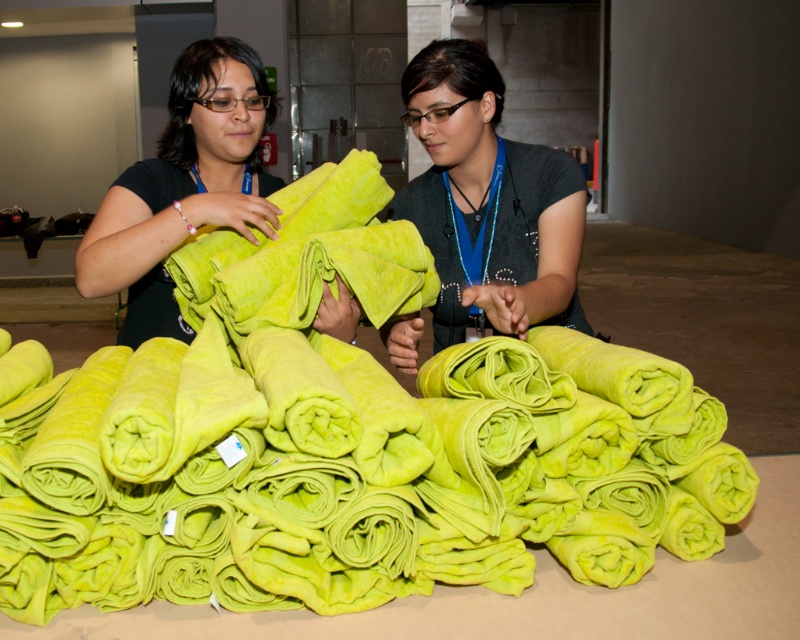
Question: Is lime green fleece blanket at center below matte green towel at center?

Choices:
 (A) no
 (B) yes

Answer: (B)

Question: Does lime green fleece blanket at center have a larger size compared to matte green towel at center?

Choices:
 (A) yes
 (B) no

Answer: (A)

Question: Which of the following is the farthest from the observer?

Choices:
 (A) matte green towel at center
 (B) lime green fleece blanket at center

Answer: (A)

Question: Is lime green fleece blanket at center closer to the viewer compared to matte green towel at center?

Choices:
 (A) yes
 (B) no

Answer: (A)

Question: Which object appears farthest from the camera in this image?

Choices:
 (A) matte green towel at center
 (B) lime green fleece blanket at center

Answer: (A)